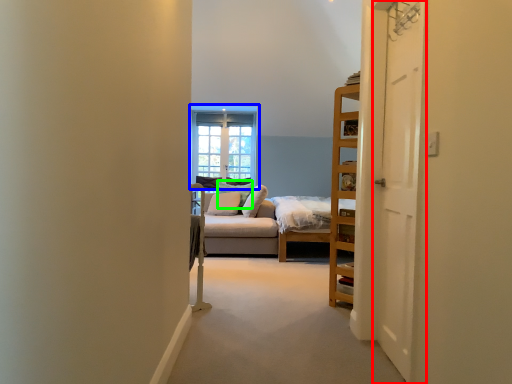
Question: Which is nearer to the door (highlighted by a red box)? window (highlighted by a blue box) or pillow (highlighted by a green box).

Choices:
 (A) window
 (B) pillow

Answer: (B)